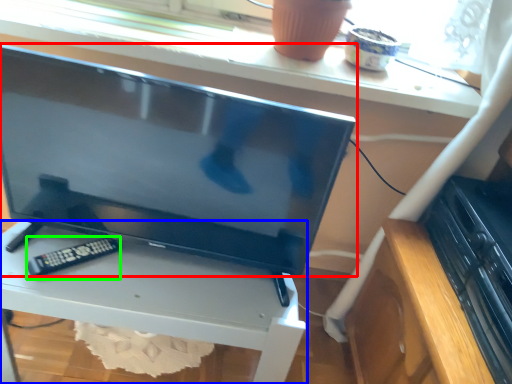
Question: Which is farther away from television (highlighted by a red box)? furniture (highlighted by a blue box) or control (highlighted by a green box)?

Choices:
 (A) furniture
 (B) control

Answer: (B)